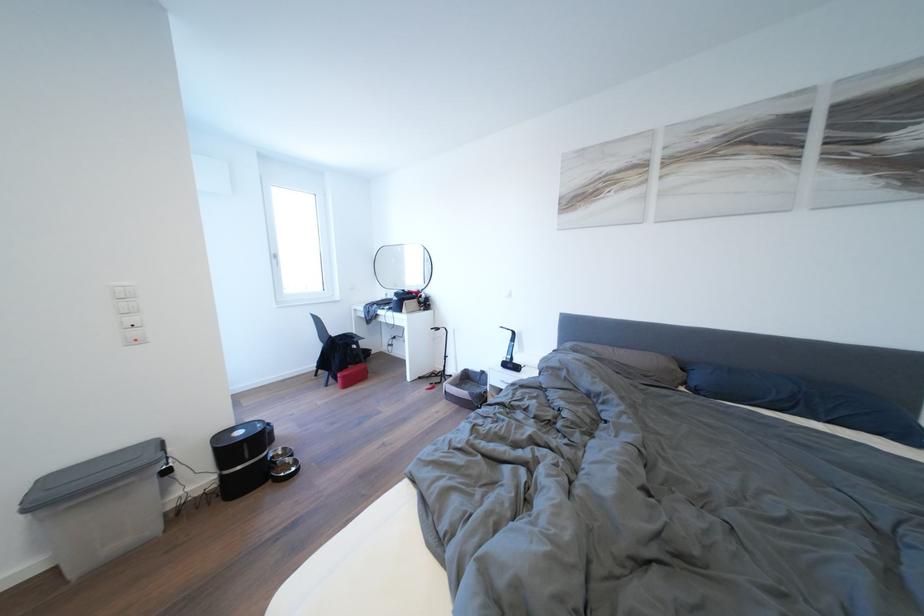
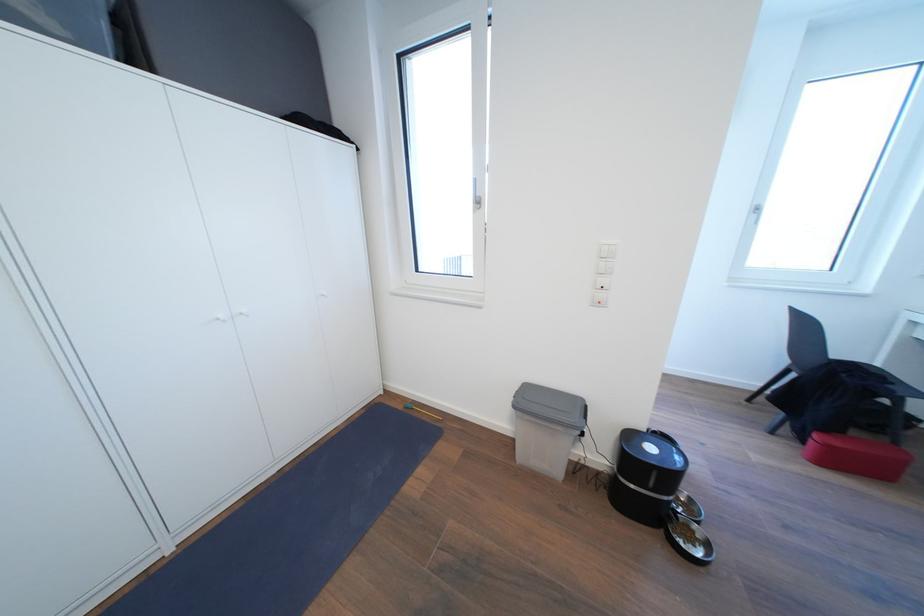
Looking at this image, the first image is from the beginning of the video and the second image is from the end. How did the camera likely rotate when shooting the video?

The camera's rotation is toward left-down.